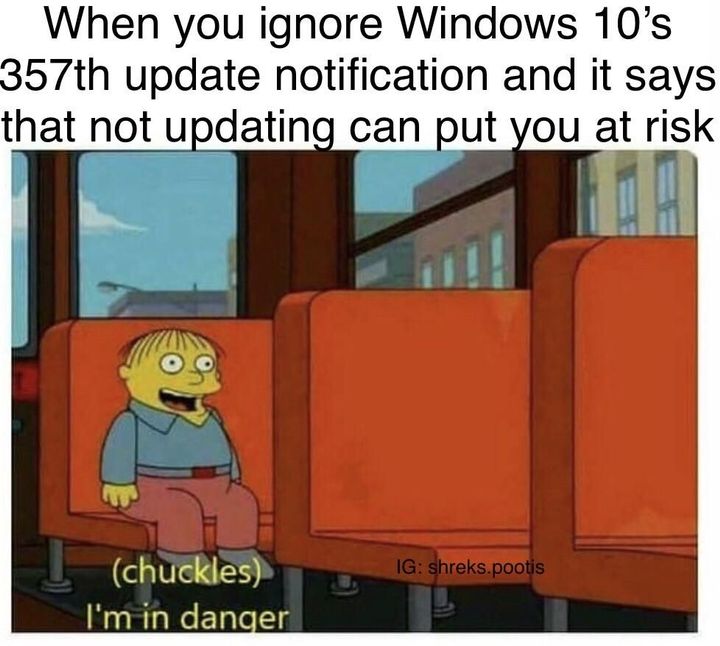
Image resolution: width=720 pixels, height=646 pixels. I want to click on seats, so click(366, 495), click(636, 490), click(247, 408).